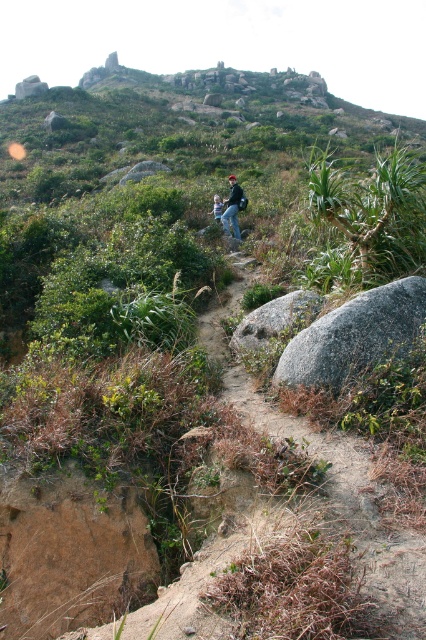
Who is taller, gray granite rock at center or gray rough rock at center?

gray granite rock at center

How far apart are gray granite rock at center and gray rough rock at center?

The distance of gray granite rock at center from gray rough rock at center is 1.41 meters.

At what (x,y) coordinates should I click in order to perform the action: click on gray granite rock at center. Please return your answer as a coordinate pair (x, y). This screenshot has width=426, height=640. Looking at the image, I should click on (354, 336).

Identify the location of gray granite rock at center. (354, 336).

Can you confirm if dirt path at center is taller than green leafy plant at center-right?

No, dirt path at center is not taller than green leafy plant at center-right.

Is point (242, 484) farther from camera compared to point (321, 179)?

No, it is not.

Where is `dirt path at center`? dirt path at center is located at coordinates (316, 547).

Is dirt path at center thinner than blue jeans at center?

In fact, dirt path at center might be wider than blue jeans at center.

Is dirt path at center bigger than blue jeans at center?

Correct, dirt path at center is larger in size than blue jeans at center.

Is point (210, 449) in front of point (230, 189)?

Yes, it is.

Where is `dirt path at center`? dirt path at center is located at coordinates 316,547.